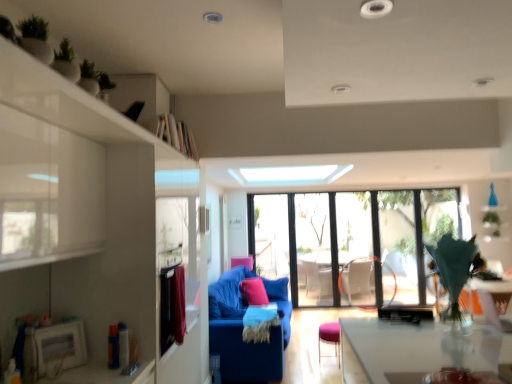
Question: From the image's perspective, would you say pink fabric pillow at center is positioned over green matte plant at upper left, placed as the third plant when sorted from back to front?

Choices:
 (A) no
 (B) yes

Answer: (A)

Question: Is pink fabric pillow at center shorter than green matte plant at upper left, the 3th plant positioned from the bottom?

Choices:
 (A) yes
 (B) no

Answer: (B)

Question: From a real-world perspective, does pink fabric pillow at center stand above green matte plant at upper left, which appears as the 1th plant when viewed from the left?

Choices:
 (A) yes
 (B) no

Answer: (B)

Question: Does pink fabric pillow at center touch green matte plant at upper left, the third plant from the right?

Choices:
 (A) no
 (B) yes

Answer: (A)

Question: Is pink fabric pillow at center positioned with its back to green matte plant at upper left, which is the 1th plant in front-to-back order?

Choices:
 (A) no
 (B) yes

Answer: (A)

Question: Is pink fabric pillow at center positioned in front of green matte plant at upper left, placed as the third plant when sorted from back to front?

Choices:
 (A) no
 (B) yes

Answer: (A)

Question: Could pink fabric armchair at center be considered to be inside green matte plant at upper right, which is the third plant from front to back?

Choices:
 (A) yes
 (B) no

Answer: (B)

Question: Is green matte plant at upper right, which is the first plant in right-to-left order, at the right side of pink fabric armchair at center?

Choices:
 (A) no
 (B) yes

Answer: (B)

Question: Can you confirm if green matte plant at upper right, acting as the second plant starting from the top, is positioned to the left of pink fabric armchair at center?

Choices:
 (A) no
 (B) yes

Answer: (A)

Question: Does green matte plant at upper right, the 2th plant in the bottom-to-top sequence, turn towards pink fabric armchair at center?

Choices:
 (A) no
 (B) yes

Answer: (A)

Question: From a real-world perspective, is green matte plant at upper right, the 3th plant when ordered from left to right, on top of pink fabric armchair at center?

Choices:
 (A) no
 (B) yes

Answer: (B)

Question: From a real-world perspective, is green matte plant at upper right, which is counted as the first plant, starting from the back, under pink fabric armchair at center?

Choices:
 (A) no
 (B) yes

Answer: (A)

Question: From a real-world perspective, is pink fabric armchair at center located beneath transparent glass window at center?

Choices:
 (A) yes
 (B) no

Answer: (A)